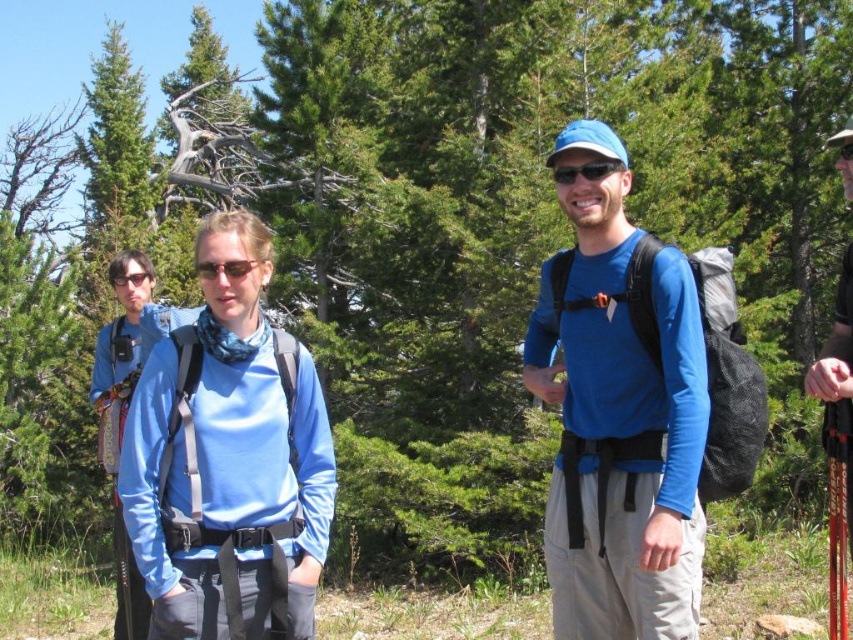
You are a photographer trying to capture the two people in the scene. You notice the matte blue shirt at center and the black matte sunglasses at center. Which object is located to the left of the other?

The matte blue shirt at center is positioned on the left side of black matte sunglasses at center.

In the scene shown: Based on the scene description, where is the blue fabric shirt at center located in terms of coordinates?

The blue fabric shirt at center is located at point coordinates of (619, 419).

You are a photographer trying to capture the hikers in the forest scene. You notice the blue fabric shirt at center and the black matte sunglasses at center. Which object should you focus on first if you want to photograph the one that is positioned more to the left?

The black matte sunglasses at center is positioned to the left of the blue fabric shirt at center, so you should focus on the black matte sunglasses at center first.